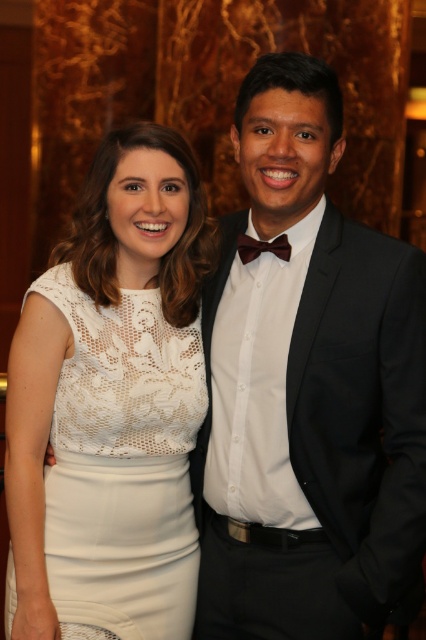
You are standing in front of a portrait of two people. There is a point at coordinates point (x=394, y=417). If you want to touch this point with a 1.5 meter long stick, will the stick be long enough?

The distance of point (x=394, y=417) from the camera is 1.76 meters. Since the stick is only 1.5 meters long, it will not be long enough to reach the point.

You are a photographer setting up a shoot in this scene. You need to position a backdrop that covers the entire area behind the lace fabric dress at center and the black wool suit at right. Which object requires a larger portion of the backdrop to cover its area?

The black wool suit at right requires a larger portion of the backdrop because it occupies more space than the lace fabric dress at center.